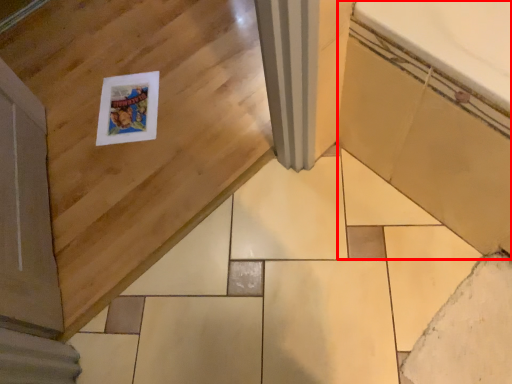
Question: From the image's perspective, what is the correct spatial relationship of bath (annotated by the red box) in relation to ceramic tile?

Choices:
 (A) above
 (B) below

Answer: (A)